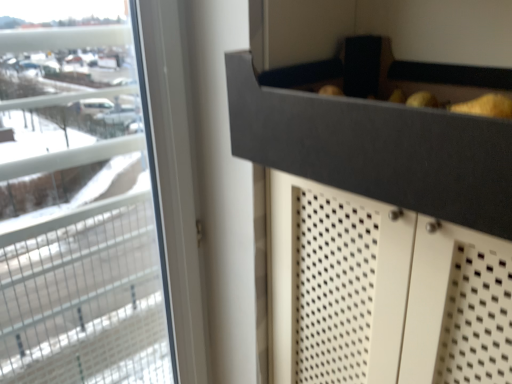
Question: Is black matte drawer at upper center next to transparent glass window at left?

Choices:
 (A) yes
 (B) no

Answer: (B)

Question: Is black matte drawer at upper center at the right side of transparent glass window at left?

Choices:
 (A) yes
 (B) no

Answer: (A)

Question: Considering the relative positions of black matte drawer at upper center and transparent glass window at left in the image provided, is black matte drawer at upper center to the left of transparent glass window at left from the viewer's perspective?

Choices:
 (A) no
 (B) yes

Answer: (A)

Question: Does black matte drawer at upper center have a greater height compared to transparent glass window at left?

Choices:
 (A) yes
 (B) no

Answer: (B)

Question: From the image's perspective, is black matte drawer at upper center above transparent glass window at left?

Choices:
 (A) yes
 (B) no

Answer: (A)

Question: Can you confirm if black matte drawer at upper center is shorter than transparent glass window at left?

Choices:
 (A) no
 (B) yes

Answer: (B)

Question: Can you confirm if transparent glass window at left is wider than black matte drawer at upper center?

Choices:
 (A) no
 (B) yes

Answer: (A)

Question: From the image's perspective, is transparent glass window at left beneath black matte drawer at upper center?

Choices:
 (A) yes
 (B) no

Answer: (A)

Question: From a real-world perspective, is transparent glass window at left located higher than black matte drawer at upper center?

Choices:
 (A) yes
 (B) no

Answer: (B)

Question: Does transparent glass window at left have a lesser height compared to black matte drawer at upper center?

Choices:
 (A) yes
 (B) no

Answer: (B)

Question: Considering the relative sizes of transparent glass window at left and black matte drawer at upper center in the image provided, is transparent glass window at left smaller than black matte drawer at upper center?

Choices:
 (A) yes
 (B) no

Answer: (B)

Question: Is transparent glass window at left facing away from black matte drawer at upper center?

Choices:
 (A) yes
 (B) no

Answer: (B)

Question: In the image, is black matte drawer at upper center on the left side or the right side of transparent glass window at left?

Choices:
 (A) left
 (B) right

Answer: (B)